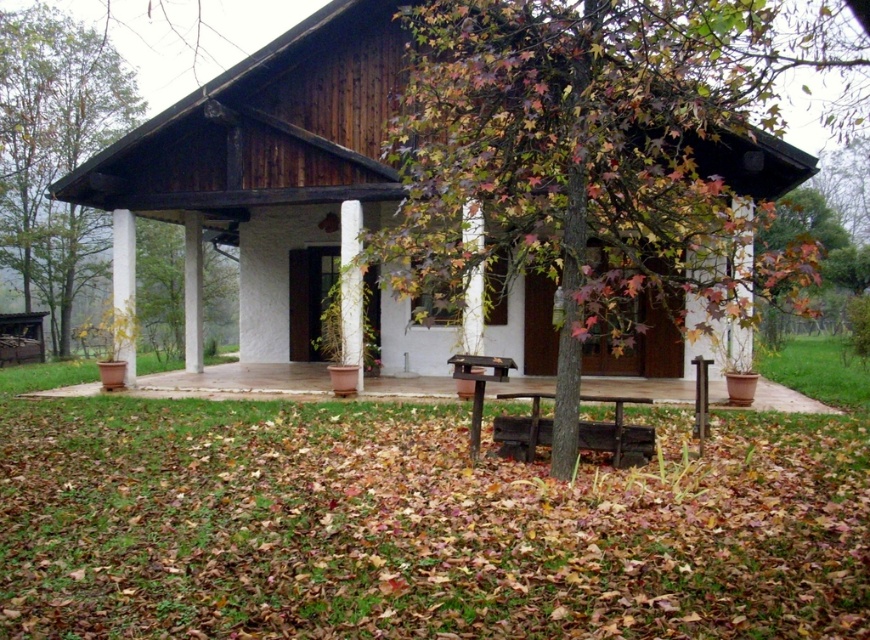
Who is shorter, green leafy tree at left or brown wooden park bench at center?

Standing shorter between the two is brown wooden park bench at center.

Locate an element on the screen. green leafy tree at left is located at coordinates (55, 150).

Can you confirm if smooth concrete porch at center is bigger than dark brown wooden picnic table at center?

Yes, smooth concrete porch at center is bigger than dark brown wooden picnic table at center.

Who is taller, smooth concrete porch at center or dark brown wooden picnic table at center?

smooth concrete porch at center is taller.

Looking at this image, measure the distance between smooth concrete porch at center and camera.

10.62 meters

Where is `smooth concrete porch at center`? The width and height of the screenshot is (870, 640). smooth concrete porch at center is located at coordinates (238, 381).

Is wooden cabin at center bigger than brown wooden park bench at center?

Correct, wooden cabin at center is larger in size than brown wooden park bench at center.

Is wooden cabin at center shorter than brown wooden park bench at center?

In fact, wooden cabin at center may be taller than brown wooden park bench at center.

Between point (239, 120) and point (500, 371), which one is positioned behind?

Positioned behind is point (239, 120).

Locate an element on the screen. This screenshot has height=640, width=870. wooden cabin at center is located at coordinates (261, 170).